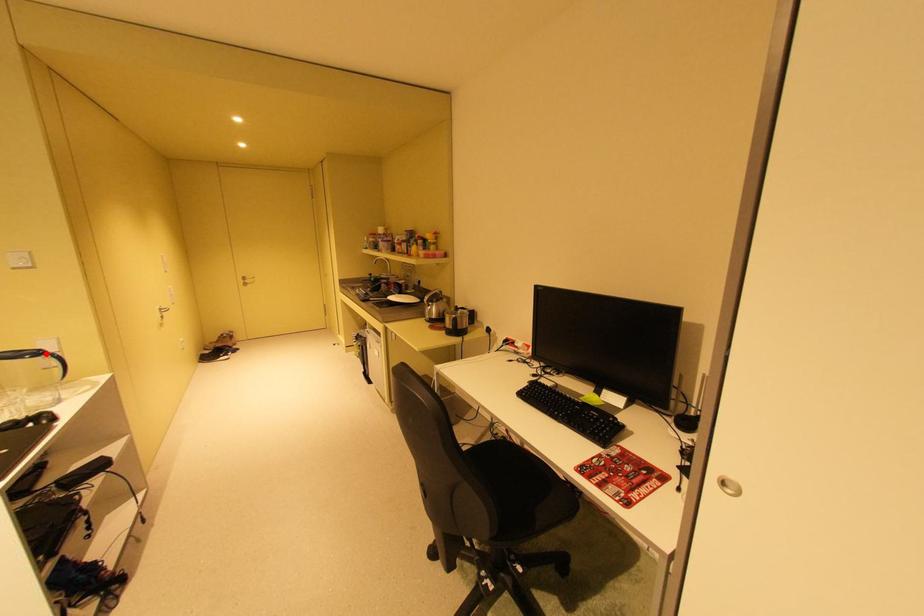
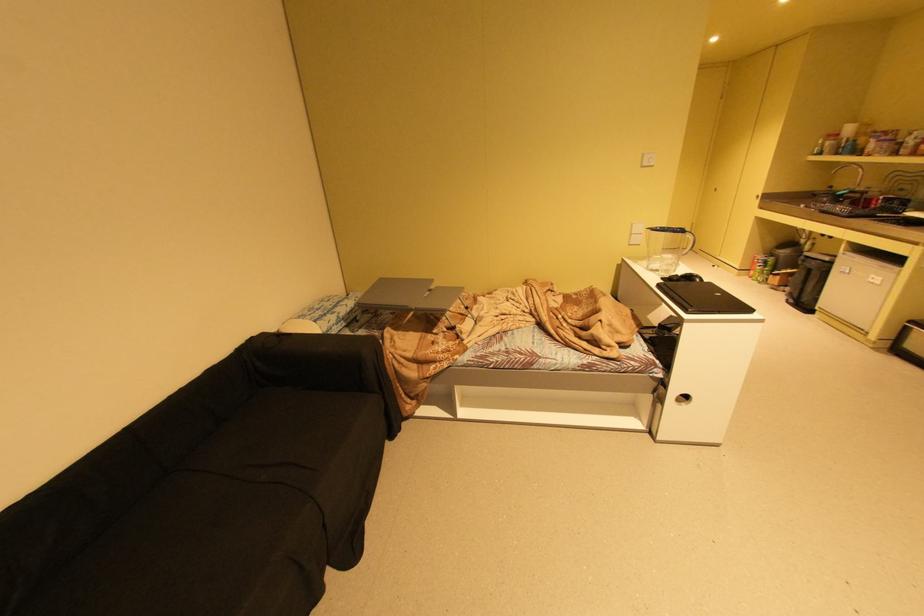
Question: I am providing you with two images of the same scene from different viewpoints. Image1 has a red point marked. In image2, the corresponding 3D location appears at what relative position? Reply with the corresponding letter.

Choices:
 (A) Closer
 (B) Farther

Answer: (A)